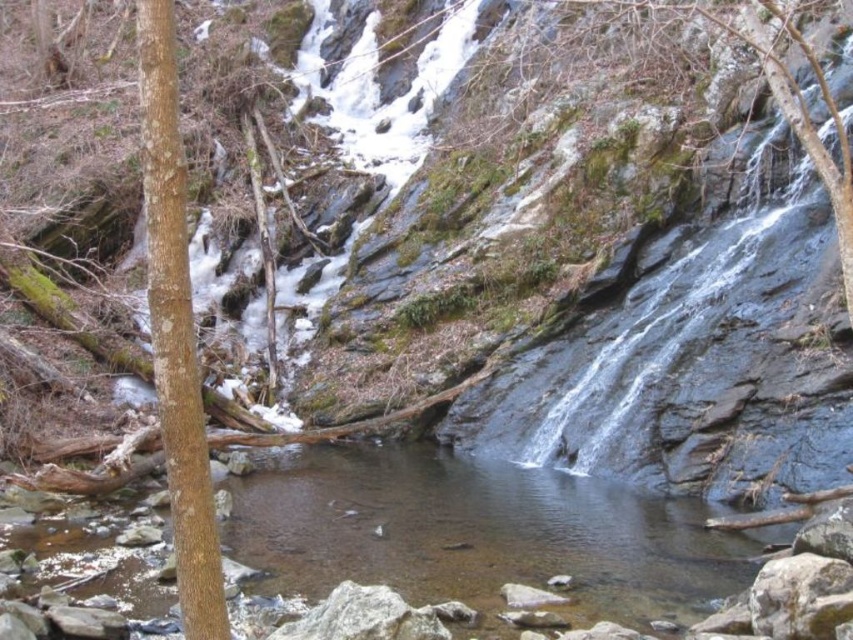
Question: Does clear water stream at center appear on the left side of brown rough bark tree at left?

Choices:
 (A) no
 (B) yes

Answer: (A)

Question: Which object appears closest to the camera in this image?

Choices:
 (A) brown rough bark tree at left
 (B) clear water stream at center

Answer: (A)

Question: Among these points, which one is nearest to the camera?

Choices:
 (A) (170, 145)
 (B) (332, 477)

Answer: (A)

Question: Is clear water stream at center behind brown rough bark tree at left?

Choices:
 (A) no
 (B) yes

Answer: (B)

Question: Does clear water stream at center have a larger size compared to brown rough bark tree at left?

Choices:
 (A) no
 (B) yes

Answer: (B)